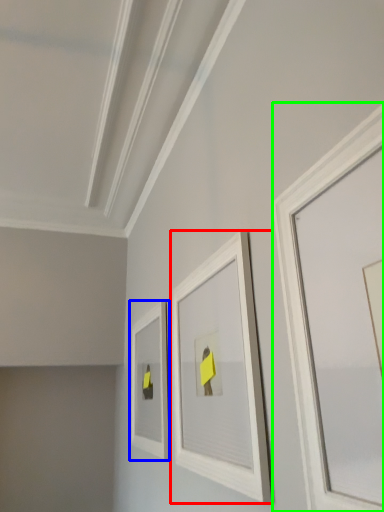
Question: Which is farther away from picture frame (highlighted by a red box)? picture frame (highlighted by a blue box) or picture frame (highlighted by a green box)?

Choices:
 (A) picture frame
 (B) picture frame

Answer: (A)